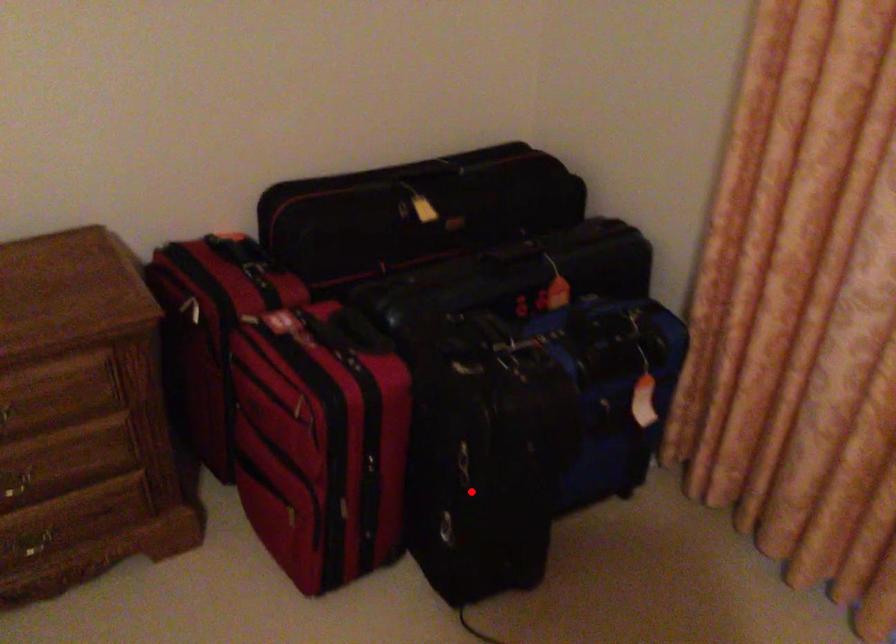
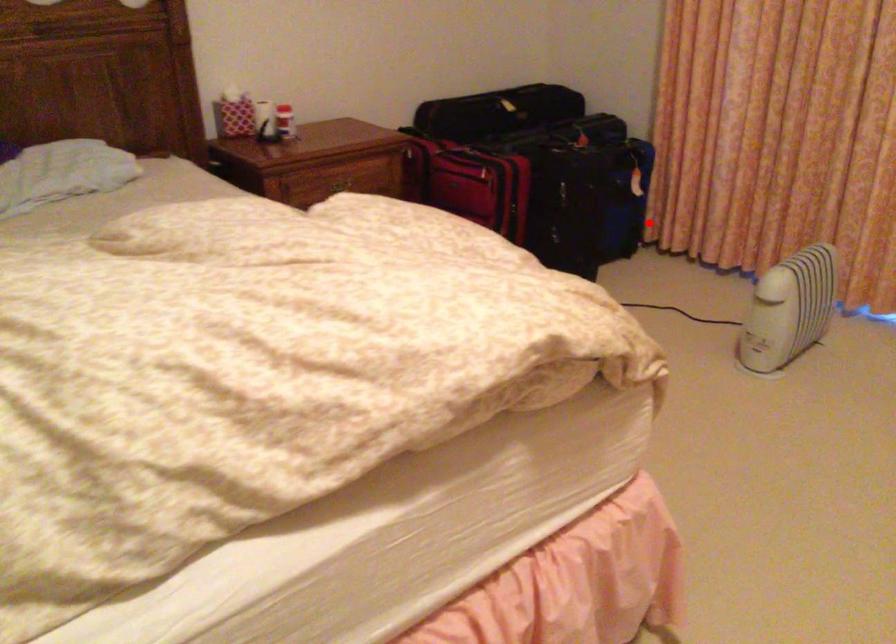
I am providing you with two images of the same scene from different viewpoints. A red point is marked on the first image and another point is marked on the second image. Does the point marked in image1 correspond to the same location as the one in image2?

No